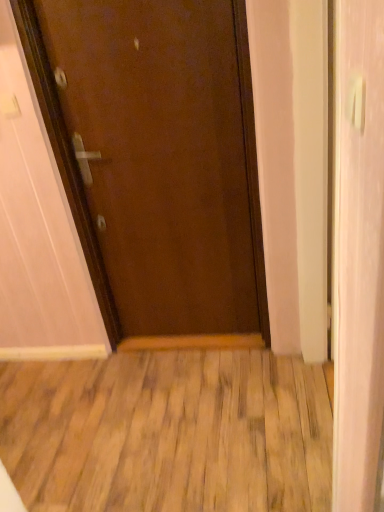
The width and height of the screenshot is (384, 512). I want to click on free space above wooden floor at center (from a real-world perspective), so click(224, 413).